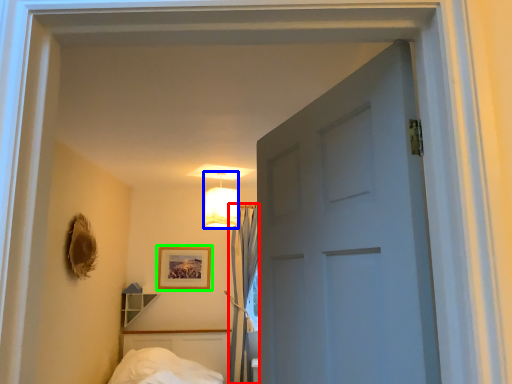
Question: Which object is positioned closest to curtain (highlighted by a red box)? Select from lamp (highlighted by a blue box) and picture frame (highlighted by a green box).

Choices:
 (A) lamp
 (B) picture frame

Answer: (B)